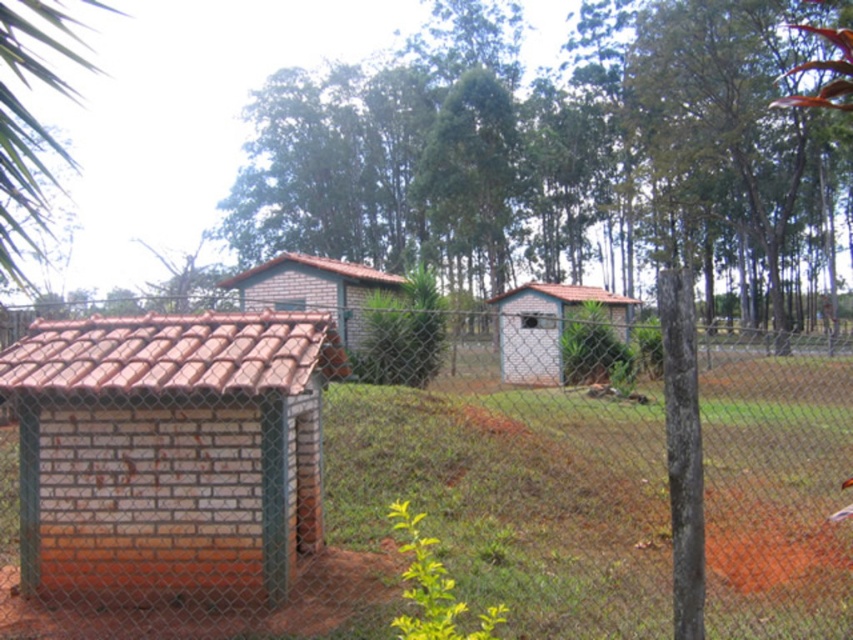
You are a farmer checking the height of your two huts inside the fence. Which one is taller, the white brick hut at center or the brown brick hut at center?

The white brick hut at center is much taller than the brown brick hut at center.

You are standing in the rural scene and want to know how far the point at coordinates (618, 321) is from your current position. Can you determine the distance?

The point at coordinates (618, 321) is 24.82 meters from the viewer.